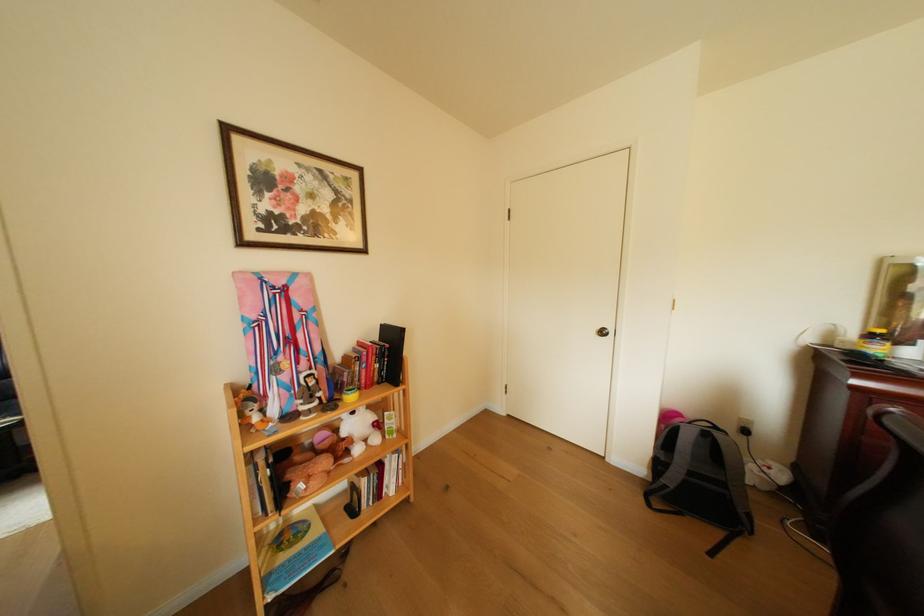
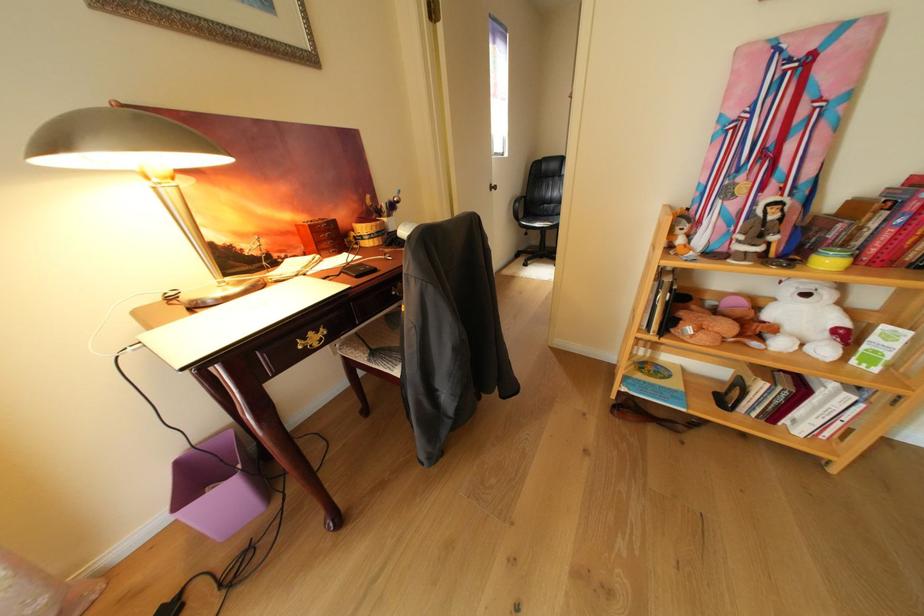
Find the pixel in the second image that matches point 261,413 in the first image.

(689, 230)